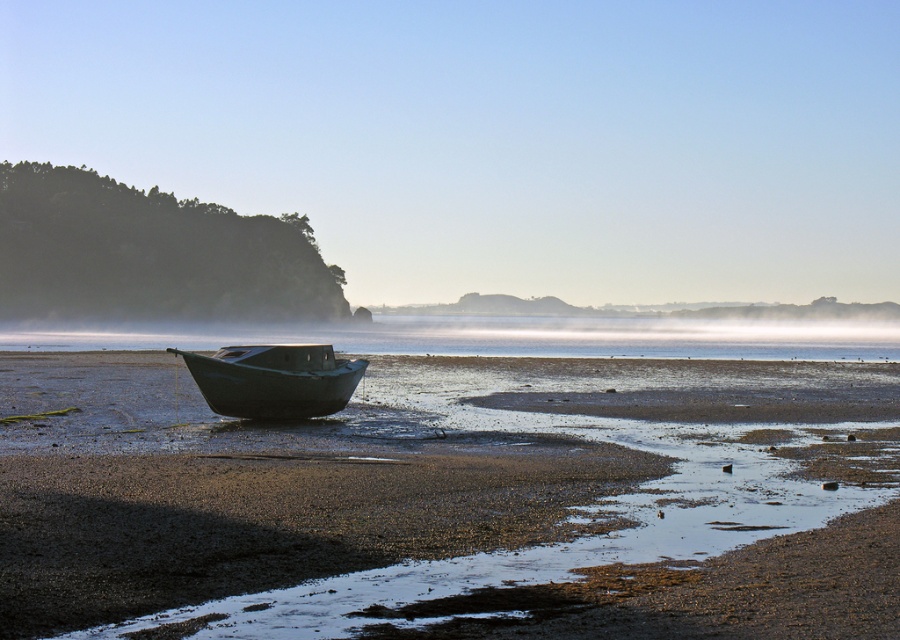
You are a marine biologist examining the boats stranded on the beach. Which boat has a greater width between the smooth mud boat at center and the green matte boat at center?

The smooth mud boat at center has a greater width than the green matte boat at center according to the description.

You are standing at the center of the beach and want to reach the smooth mud boat at center. According to the coordinates provided, in which direction should you walk to reach it?

The smooth mud boat at center is located at coordinates point (x=453, y=499). Since you are at the center of the beach, you should walk towards the right direction to reach the smooth mud boat at center.